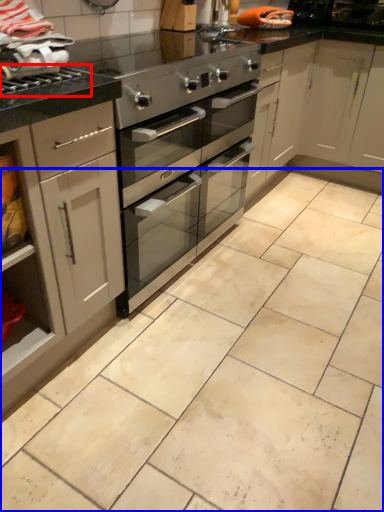
Question: Which object is closer to the camera taking this photo, gas stove (highlighted by a red box) or counter (highlighted by a blue box)?

Choices:
 (A) gas stove
 (B) counter

Answer: (B)